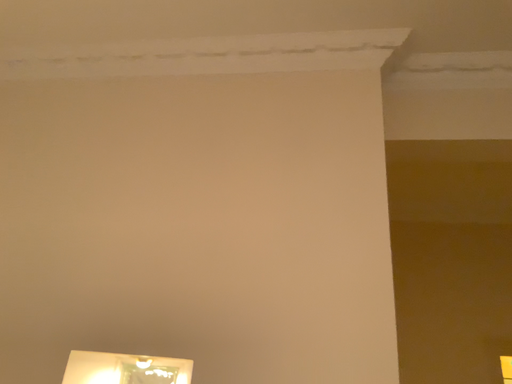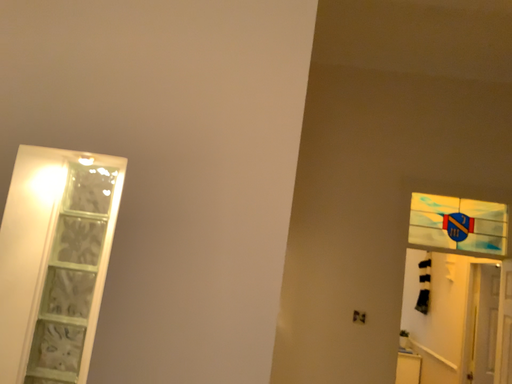
Question: Which way did the camera rotate in the video?

Choices:
 (A) rotated upward
 (B) rotated downward

Answer: (B)